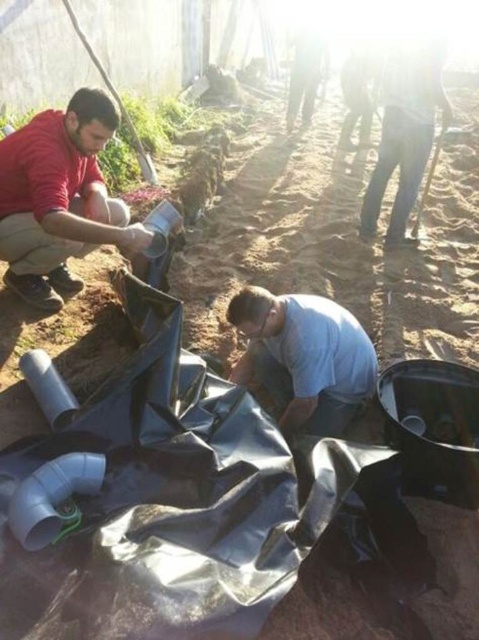
Question: Which of the following is the farthest from the observer?

Choices:
 (A) dark blue jeans at right
 (B) light blue fabric at center

Answer: (A)

Question: Among these objects, which one is farthest from the camera?

Choices:
 (A) matte red shirt at upper left
 (B) dark blue jeans at right
 (C) light blue fabric at center

Answer: (B)

Question: Can you confirm if light blue fabric at center is thinner than dark blue jeans at right?

Choices:
 (A) yes
 (B) no

Answer: (B)

Question: Does matte red shirt at upper left lie behind light blue fabric at center?

Choices:
 (A) no
 (B) yes

Answer: (B)

Question: Can you confirm if matte red shirt at upper left is positioned above light blue fabric at center?

Choices:
 (A) yes
 (B) no

Answer: (A)

Question: Based on their relative distances, which object is nearer to the light blue fabric at center?

Choices:
 (A) matte red shirt at upper left
 (B) dark blue jeans at right

Answer: (A)